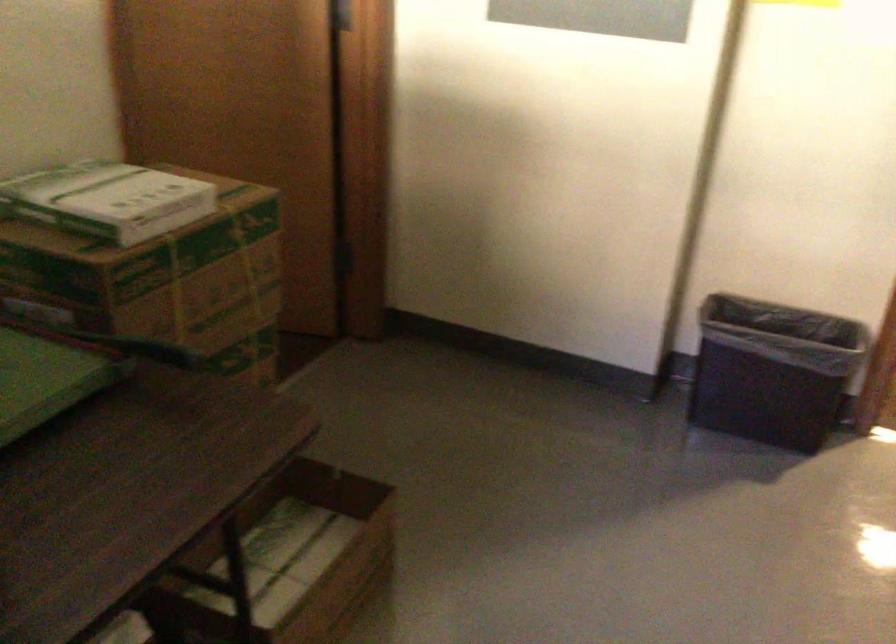
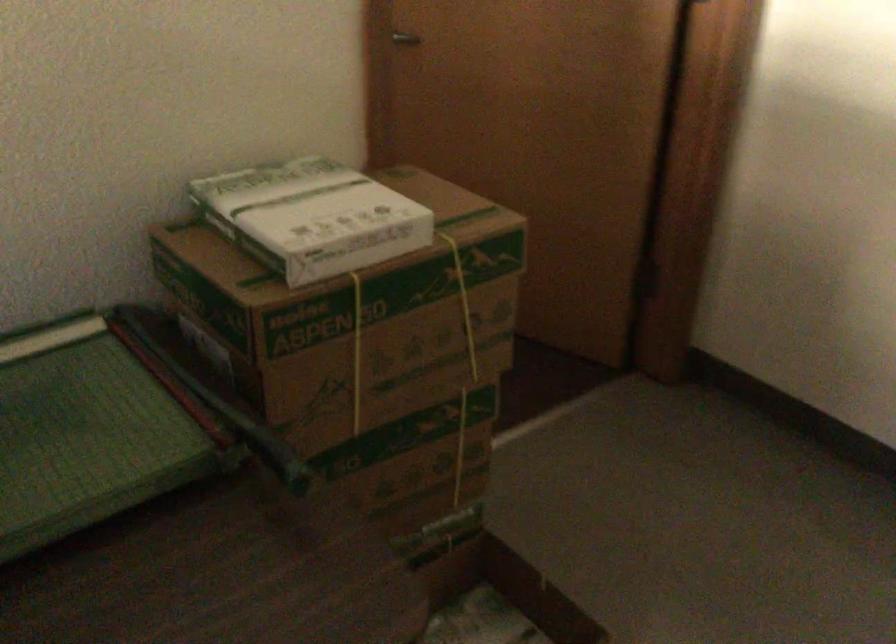
Question: The images are taken continuously from a first-person perspective. In which direction is your viewpoint rotating?

Choices:
 (A) Left
 (B) Right
 (C) Up
 (D) Down

Answer: (A)